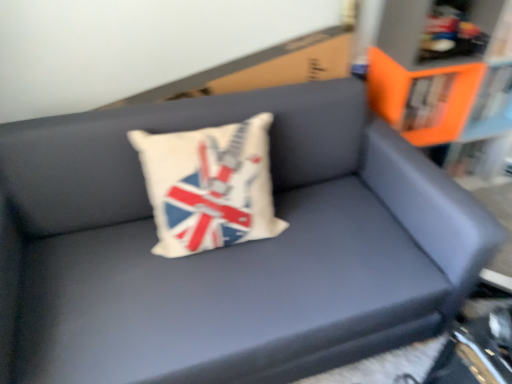
Question: From a real-world perspective, is white fabric pillow at center positioned above or below orange plastic bookcase at upper right?

Choices:
 (A) below
 (B) above

Answer: (B)

Question: Looking at the image, does white fabric pillow at center seem bigger or smaller compared to orange plastic bookcase at upper right?

Choices:
 (A) small
 (B) big

Answer: (A)

Question: Is point (187, 223) closer or farther from the camera than point (377, 91)?

Choices:
 (A) farther
 (B) closer

Answer: (B)

Question: From their relative heights in the image, would you say orange plastic bookcase at upper right is taller or shorter than white fabric pillow at center?

Choices:
 (A) tall
 (B) short

Answer: (A)

Question: Based on their sizes in the image, would you say orange plastic bookcase at upper right is bigger or smaller than white fabric pillow at center?

Choices:
 (A) big
 (B) small

Answer: (A)

Question: Is orange plastic bookcase at upper right to the left or to the right of white fabric pillow at center in the image?

Choices:
 (A) left
 (B) right

Answer: (B)

Question: Considering the positions of orange plastic bookcase at upper right and white fabric pillow at center in the image, is orange plastic bookcase at upper right wider or thinner than white fabric pillow at center?

Choices:
 (A) thin
 (B) wide

Answer: (B)